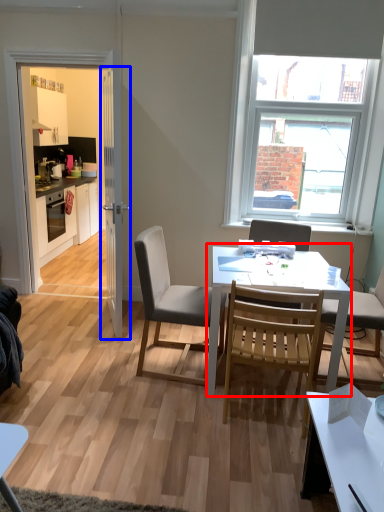
Question: Which object appears closest to the camera in this image, round table (highlighted by a red box) or door (highlighted by a blue box)?

Choices:
 (A) round table
 (B) door

Answer: (A)